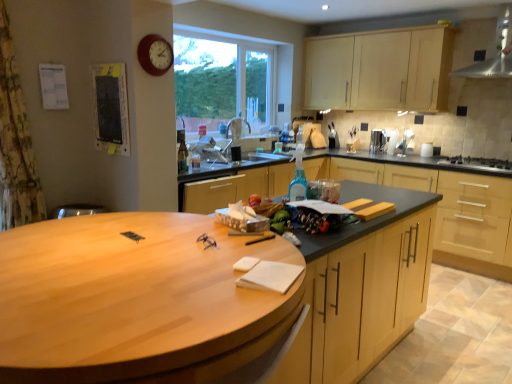
Question: Looking at the image, does satin silver kettle at upper right seem bigger or smaller compared to wooden clock at upper left?

Choices:
 (A) big
 (B) small

Answer: (A)

Question: Is satin silver kettle at upper right spatially inside wooden clock at upper left, or outside of it?

Choices:
 (A) inside
 (B) outside

Answer: (B)

Question: Which of these objects is positioned farthest from the black matte sink at center?

Choices:
 (A) matte black bulletin board at upper left
 (B) black stainless steel gas stove at right
 (C) satin silver kettle at upper right
 (D) stainless steel exhaust hood at upper right
 (E) floral fabric curtain at left

Answer: (D)

Question: Estimate the real-world distances between objects in this image. Which object is closer to the floral fabric curtain at left?

Choices:
 (A) black matte sink at center
 (B) wooden at center
 (C) matte black bulletin board at upper left
 (D) matte wood cabinets at center, the 2th cabinetry in the top-to-bottom sequence
 (E) wooden clock at upper left

Answer: (C)